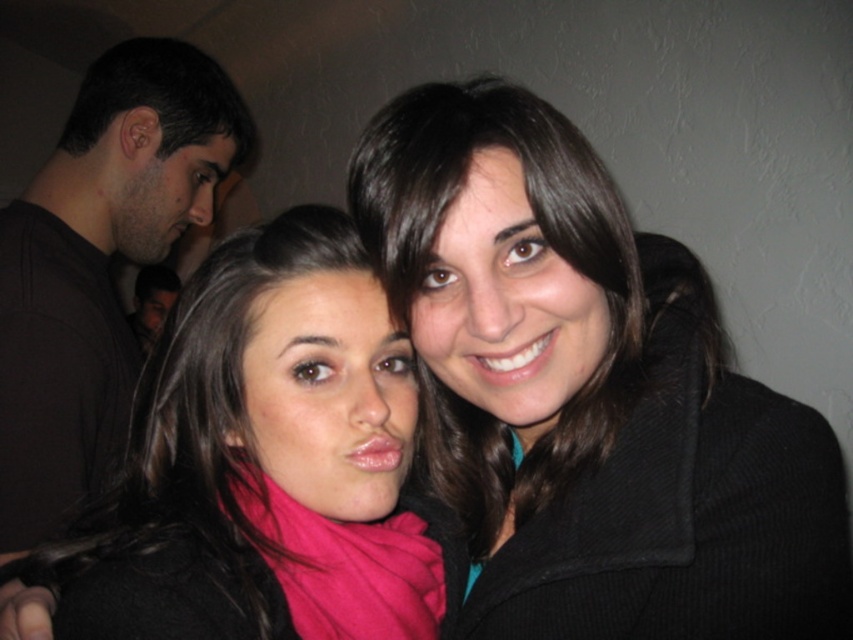
Question: Does black woolen coat at center have a smaller size compared to pink fabric scarf at center?

Choices:
 (A) yes
 (B) no

Answer: (A)

Question: Can you confirm if black woolen coat at center is thinner than pink fabric scarf at center?

Choices:
 (A) yes
 (B) no

Answer: (A)

Question: Considering the relative positions of black woolen coat at center and matte pink scarf at center in the image provided, where is black woolen coat at center located with respect to matte pink scarf at center?

Choices:
 (A) above
 (B) below

Answer: (A)

Question: Which object is positioned farthest from the matte pink scarf at center?

Choices:
 (A) black matte shirt at left
 (B) pink fabric scarf at center

Answer: (A)

Question: Which point appears closest to the camera in this image?

Choices:
 (A) (178, 490)
 (B) (346, 637)
 (C) (45, 428)
 (D) (428, 324)

Answer: (D)

Question: Estimate the real-world distances between objects in this image. Which object is farther from the pink fabric scarf at center?

Choices:
 (A) black matte shirt at left
 (B) matte pink scarf at center

Answer: (A)